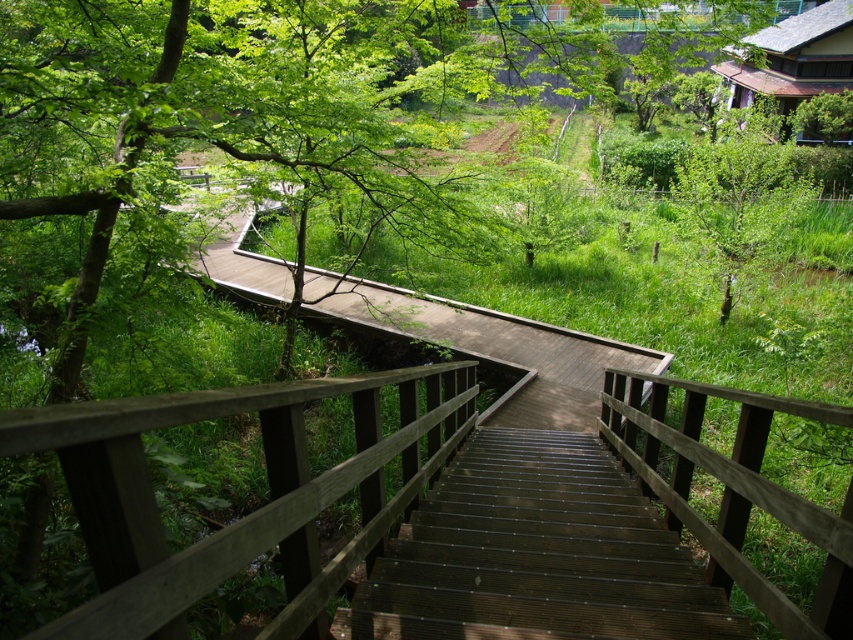
Question: Can you confirm if dark brown wood stairs at center is positioned below green leafy tree at upper right?

Choices:
 (A) yes
 (B) no

Answer: (A)

Question: Is the position of dark brown wood stairs at center more distant than that of green leafy tree at upper right?

Choices:
 (A) yes
 (B) no

Answer: (B)

Question: Which point is farther to the camera?

Choices:
 (A) dark brown wood stairs at center
 (B) green leafy tree at upper right

Answer: (B)

Question: Is dark brown wood stairs at center closer to camera compared to green leafy tree at upper right?

Choices:
 (A) yes
 (B) no

Answer: (A)